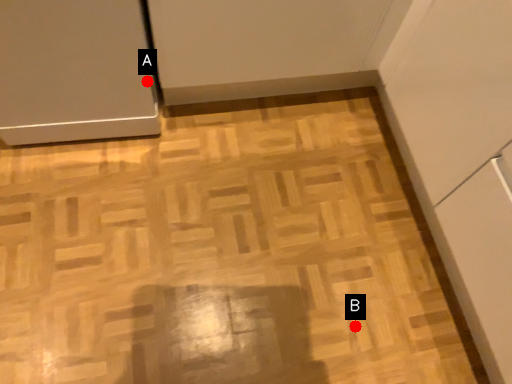
Question: Two points are circled on the image, labeled by A and B beside each circle. Among these points, which one is nearest to the camera?

Choices:
 (A) A is closer
 (B) B is closer

Answer: (A)